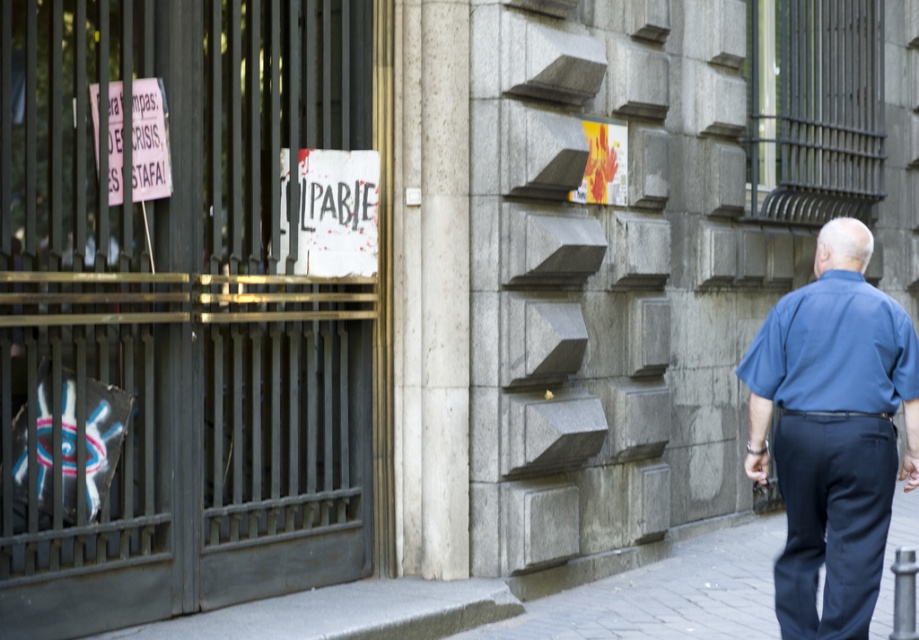
Question: Does blue short-sleeved shirt at right appear over white paper sign at left?

Choices:
 (A) no
 (B) yes

Answer: (A)

Question: Among these objects, which one is farthest from the camera?

Choices:
 (A) white paper sign at left
 (B) white paper sign at center
 (C) blue short-sleeved shirt at right
 (D) blue cotton shirt at right

Answer: (B)

Question: Observing the image, what is the correct spatial positioning of blue cotton shirt at right in reference to blue short-sleeved shirt at right?

Choices:
 (A) left
 (B) right

Answer: (B)

Question: Which point appears farthest from the camera in this image?

Choices:
 (A) (803, 337)
 (B) (325, 196)
 (C) (738, 541)
 (D) (807, 308)

Answer: (C)

Question: Does blue short-sleeved shirt at right appear on the left side of white paper sign at center?

Choices:
 (A) yes
 (B) no

Answer: (B)

Question: Among these objects, which one is nearest to the camera?

Choices:
 (A) white paper sign at center
 (B) blue short-sleeved shirt at right

Answer: (B)